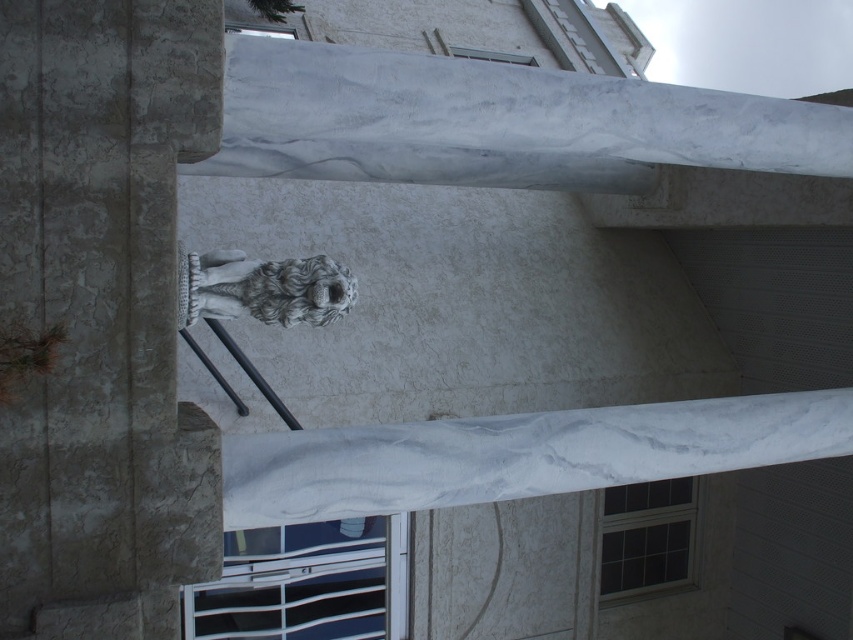
Does white marble column at center have a larger size compared to gray stone owl at center?

Yes.

Can you confirm if white marble column at center is thinner than gray stone owl at center?

In fact, white marble column at center might be wider than gray stone owl at center.

Is point (111, 99) positioned after point (287, 307)?

No, it is not.

Where is `white marble column at center`? white marble column at center is located at coordinates (102, 314).